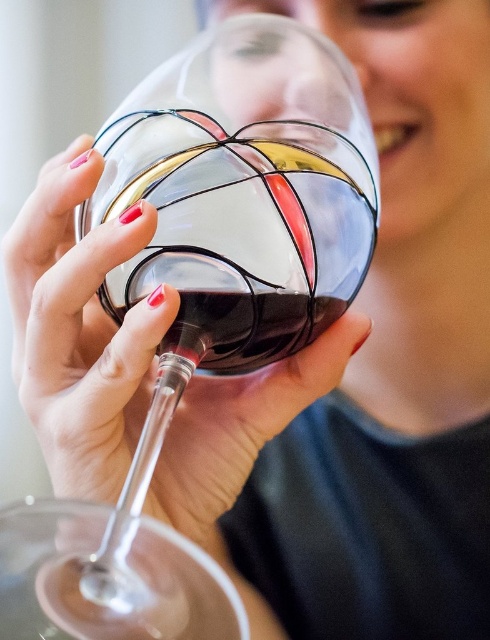
You are pouring more red wine into the clear glass wine glass at center. The dark glass wine at center is already filled to the brim. Will the wine overflow when you add more?

The clear glass wine glass at center is taller than dark glass wine at center. Since the dark glass wine at center is already filled to the brim, adding more wine will cause it to overflow.

You are a photographer adjusting the focus of your camera. The clear glass wine glass at center is your main subject. Where should you position the focus point to ensure the glass is in sharp focus?

The clear glass wine glass at center is located at point 2D coordinates (198, 256), so you should position the focus point at that coordinate to ensure sharp focus.

You are a bartender preparing a drink. You have a clear glass wine glass at center and a dark glass wine at center. Which object can you see through more easily?

The clear glass wine glass at center can be seen through more easily since it is larger in size than the dark glass wine at center.